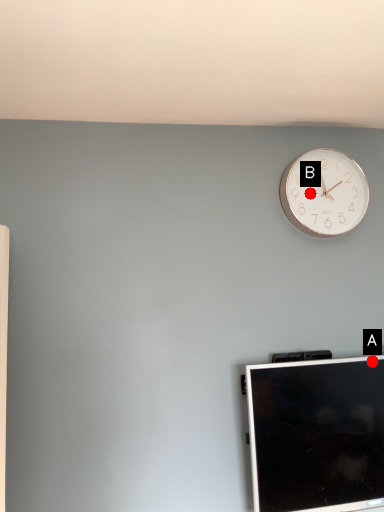
Question: Two points are circled on the image, labeled by A and B beside each circle. Which point appears closest to the camera in this image?

Choices:
 (A) A is closer
 (B) B is closer

Answer: (A)